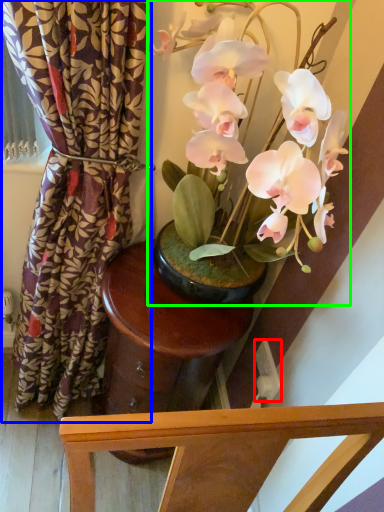
Question: Estimate the real-world distances between objects in this image. Which object is closer to power outlet (highlighted by a red box), curtain (highlighted by a blue box) or houseplant (highlighted by a green box)?

Choices:
 (A) curtain
 (B) houseplant

Answer: (B)